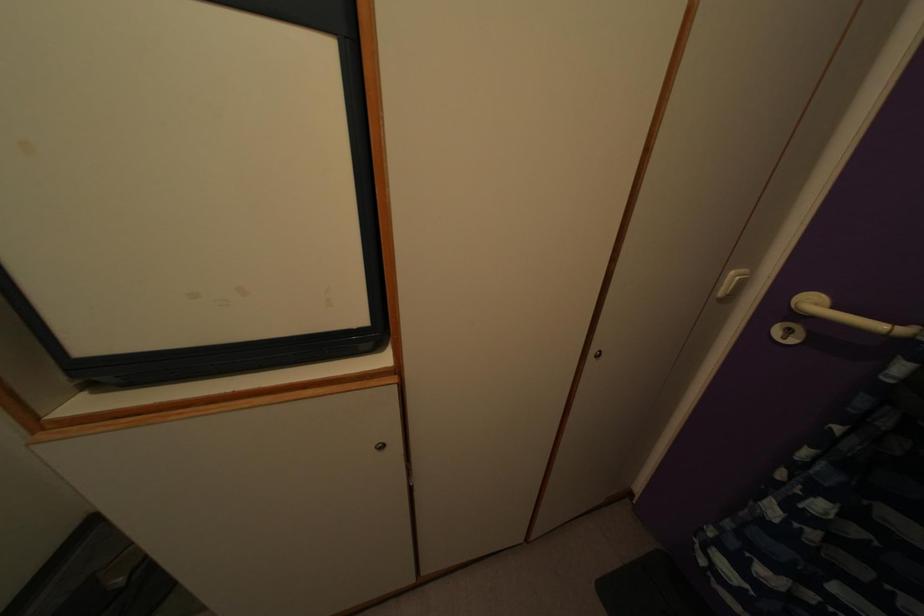
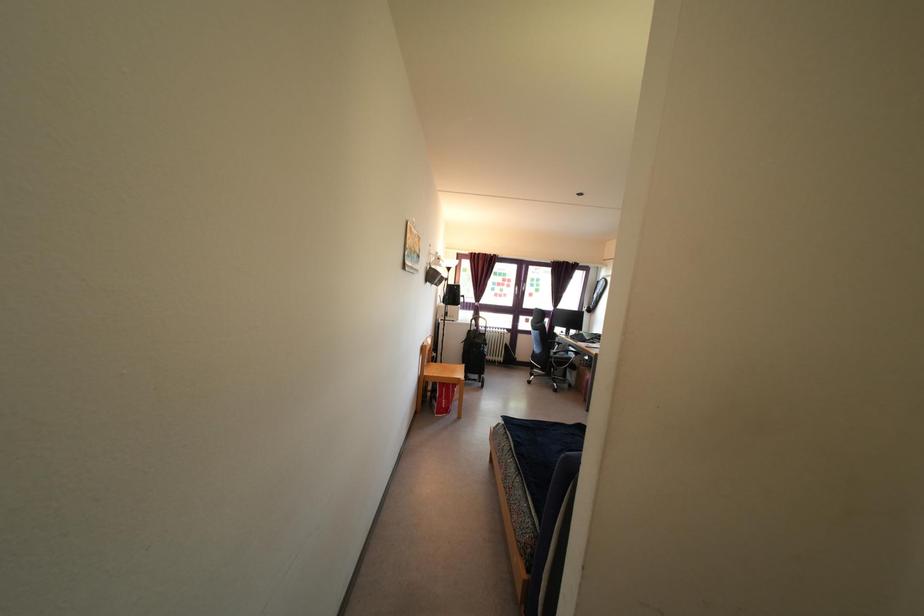
Question: Based on the continuous images, in which direction is the camera rotating? Reply with the corresponding letter.

Choices:
 (A) Left
 (B) Right
 (C) Up
 (D) Down

Answer: (A)